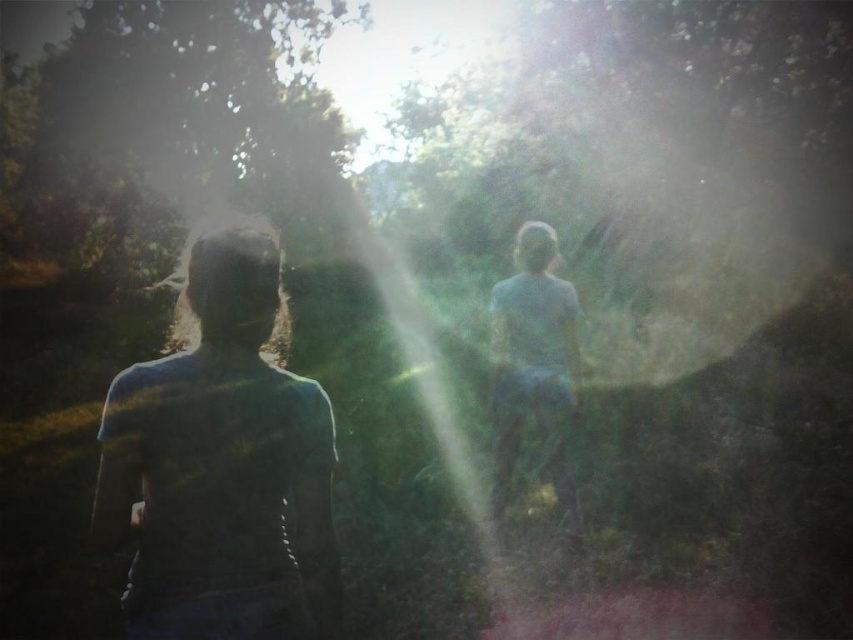
You are a photographer trying to capture the two figures in the scene. You want to ensure that both the matte blue shirt at left and the light blue fabric at center are visible in your shot. Based on their positions, which object should you focus on first to frame them properly?

The matte blue shirt at left is positioned on the left side of light blue fabric at center, so you should focus on the matte blue shirt at left first to ensure proper framing.

You are a photographer trying to capture the two figures in the scene. Since the sun is causing a lens flare, you want to adjust your camera angle to avoid it. If you move your camera slightly to the right, which object between the matte blue shirt at left and the light blue fabric at center will be closer to the center of the frame?

The light blue fabric at center will be closer to the center of the frame because it is already positioned at the center, so moving the camera to the right would keep it closer to the center compared to the matte blue shirt at left which is further left.

You are a photographer trying to capture the two figures in the scene. The matte blue shirt at left and the light blue fabric at center are both in your viewfinder. Which object should you focus on first to ensure both are in sharp focus?

The matte blue shirt at left is positioned over the light blue fabric at center, so focusing on the matte blue shirt at left will ensure both are in focus since it is closer to the camera.